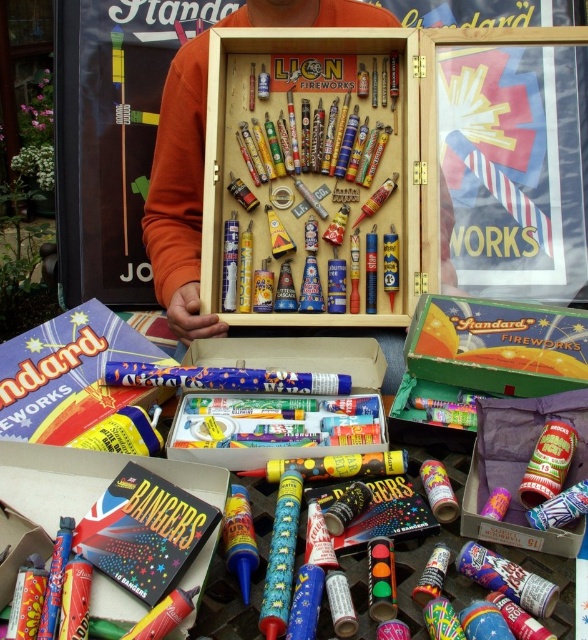
You are standing in front of the fireworks display and notice an orange cotton shirt at center and a matte cardboard box at lower left. Which object is closer to you?

The orange cotton shirt at center is closer to you because it is further to the viewer than the matte cardboard box at lower left.

You are standing in front of the fireworks display and need to locate the green cardboard box at center. According to the coordinates provided, where exactly is it positioned?

The green cardboard box at center is positioned at point 0.541 on the x axis and 0.847 on the y axis.